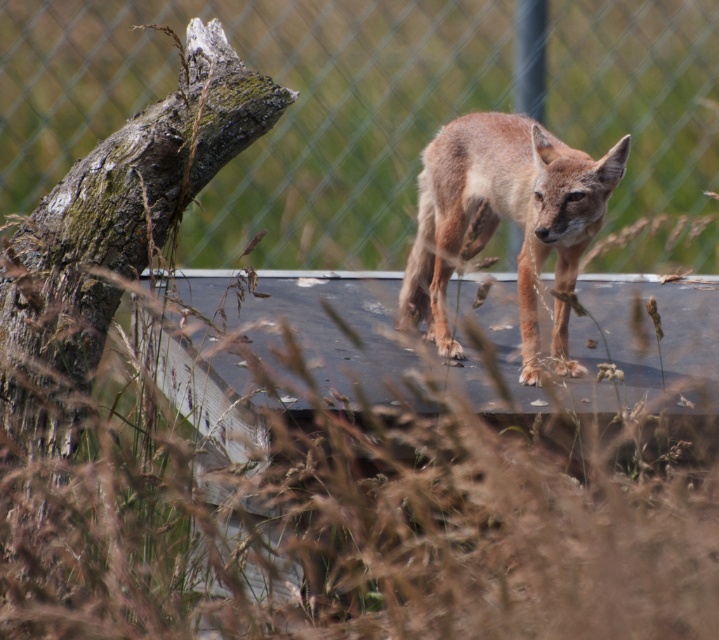
Question: Is metallic chain-link fence at center below grayish-brown bark tree trunk at left?

Choices:
 (A) yes
 (B) no

Answer: (B)

Question: Is metallic chain-link fence at center above brown fur fox at center?

Choices:
 (A) yes
 (B) no

Answer: (A)

Question: Estimate the real-world distances between objects in this image. Which object is farther from the metallic chain-link fence at center?

Choices:
 (A) brown fur fox at center
 (B) grayish-brown bark tree trunk at left

Answer: (B)

Question: Which point is farther to the camera?

Choices:
 (A) (14, 74)
 (B) (418, 307)
 (C) (36, 212)

Answer: (A)

Question: Does metallic chain-link fence at center appear under grayish-brown bark tree trunk at left?

Choices:
 (A) no
 (B) yes

Answer: (A)

Question: Estimate the real-world distances between objects in this image. Which object is farther from the grayish-brown bark tree trunk at left?

Choices:
 (A) metallic chain-link fence at center
 (B) brown fur fox at center

Answer: (A)